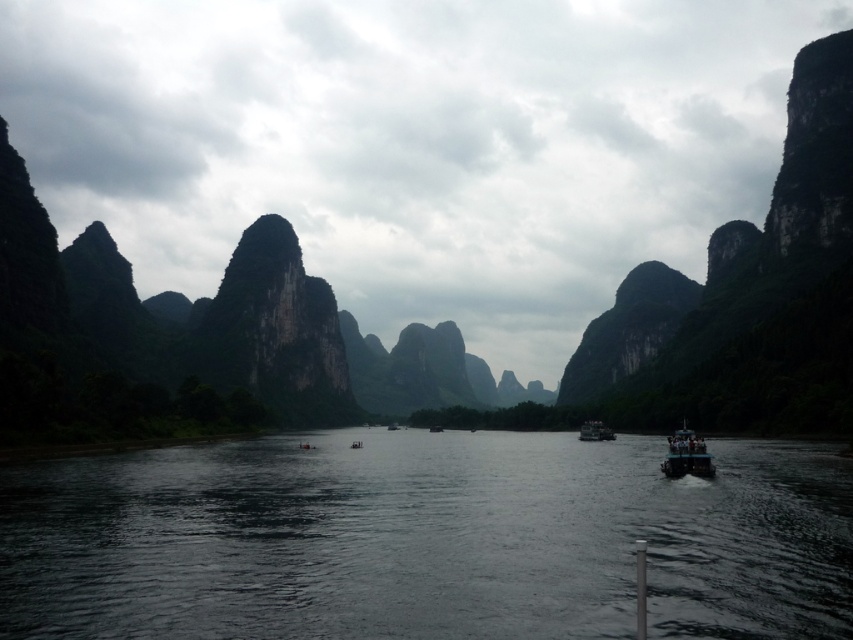
Question: Which point is closer to the camera taking this photo?

Choices:
 (A) (668, 445)
 (B) (584, 426)

Answer: (A)

Question: Can you confirm if green rock formation at center is positioned above dark blue plastic boat at center?

Choices:
 (A) no
 (B) yes

Answer: (B)

Question: Which object appears closest to the camera in this image?

Choices:
 (A) green rock formation at center
 (B) dark blue plastic boat at center

Answer: (A)

Question: Is dark blue plastic boat at lower right positioned in front of dark blue plastic boat at center?

Choices:
 (A) yes
 (B) no

Answer: (A)

Question: Which object is the closest to the dark blue plastic boat at center?

Choices:
 (A) dark blue plastic boat at lower right
 (B) dark water at center
 (C) green rock formation at center

Answer: (A)

Question: Does dark water at center lie in front of green rock formation at center?

Choices:
 (A) no
 (B) yes

Answer: (B)